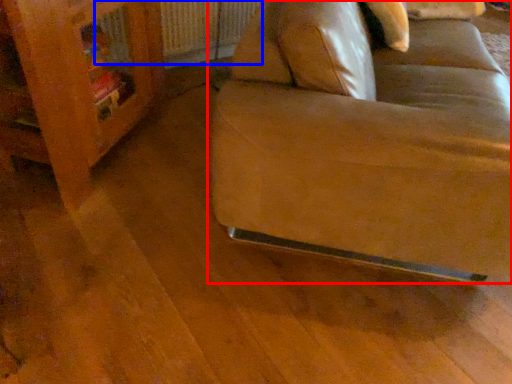
Question: Which object appears farthest to the camera in this image, studio couch (highlighted by a red box) or radiator (highlighted by a blue box)?

Choices:
 (A) studio couch
 (B) radiator

Answer: (B)